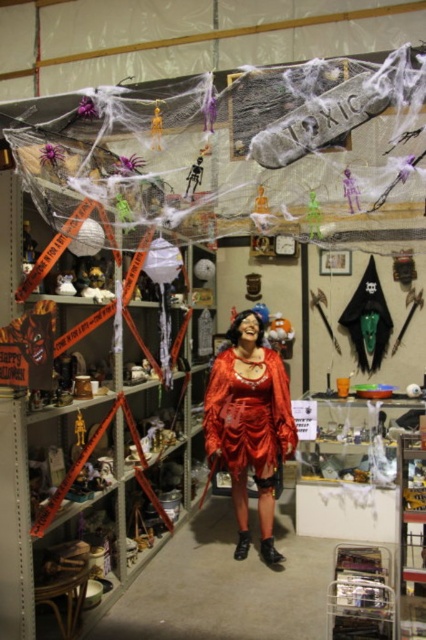
Question: Does orange paper banner at left appear under shiny red dress at center?

Choices:
 (A) yes
 (B) no

Answer: (B)

Question: Can you confirm if shiny red dress at center is wider than green plastic plant at center?

Choices:
 (A) yes
 (B) no

Answer: (A)

Question: Which object appears farthest from the camera in this image?

Choices:
 (A) orange paper banner at left
 (B) clear plastic shelf at center
 (C) shiny red dress at center

Answer: (C)

Question: Among these objects, which one is farthest from the camera?

Choices:
 (A) orange paper banner at left
 (B) shiny red dress at center
 (C) green plastic plant at center

Answer: (B)

Question: Does orange paper banner at left appear over clear plastic shelf at center?

Choices:
 (A) yes
 (B) no

Answer: (A)

Question: Which of the following is the farthest from the observer?

Choices:
 (A) (2, 614)
 (B) (212, 403)

Answer: (B)